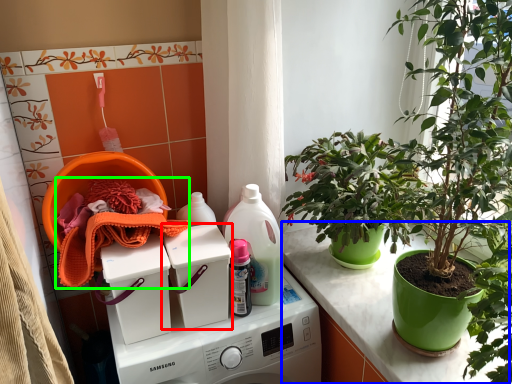
Question: Which object is positioned farthest from washing machine (highlighted by a red box)? Select from counter (highlighted by a blue box) and material (highlighted by a green box).

Choices:
 (A) counter
 (B) material

Answer: (A)